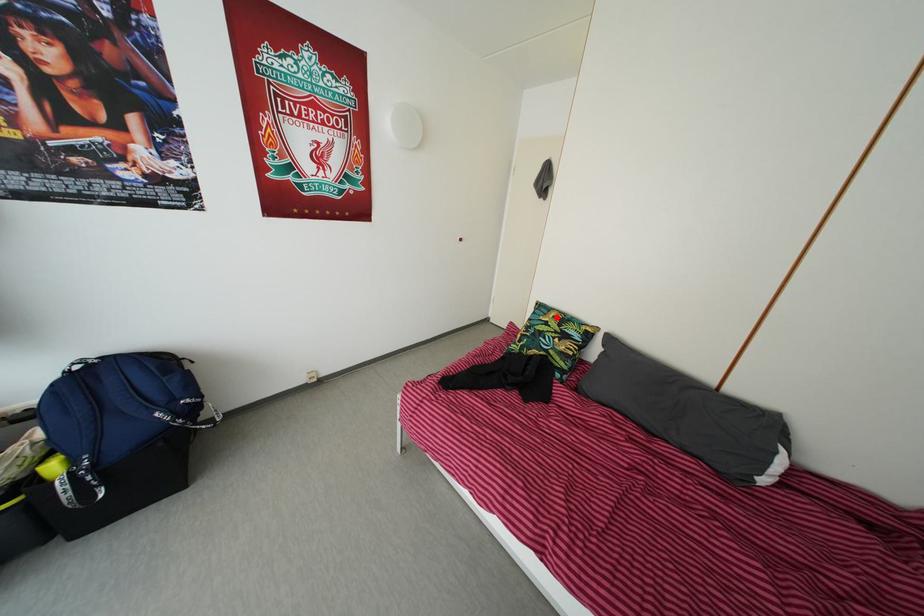
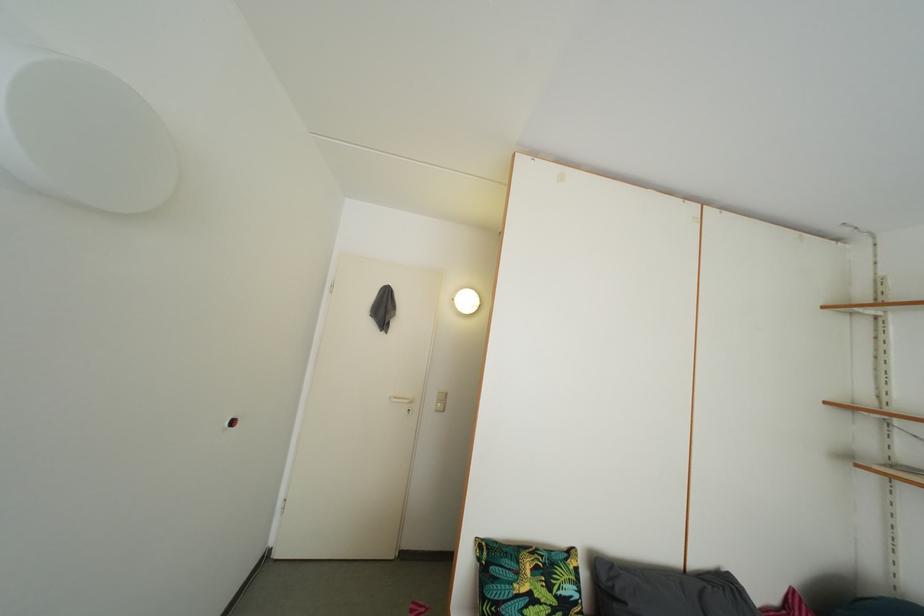
Locate, in the second image, the point that corresponds to the highlighted location in the first image.

(521, 562)